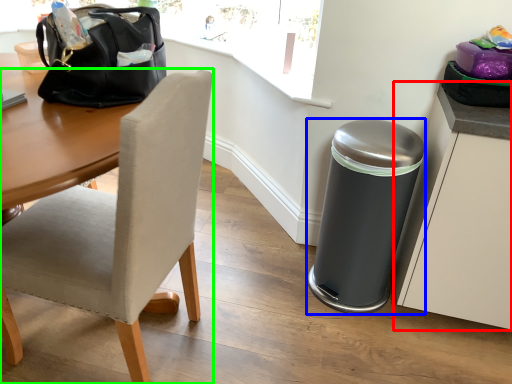
Question: Which is farther away from cabinetry (highlighted by a red box)? trash bin/can (highlighted by a blue box) or chair (highlighted by a green box)?

Choices:
 (A) trash bin/can
 (B) chair

Answer: (B)